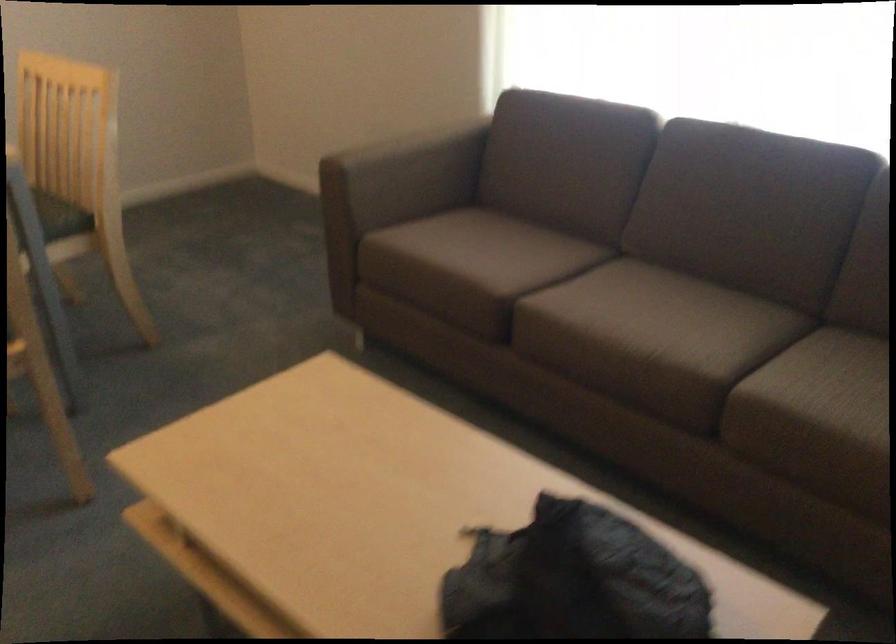
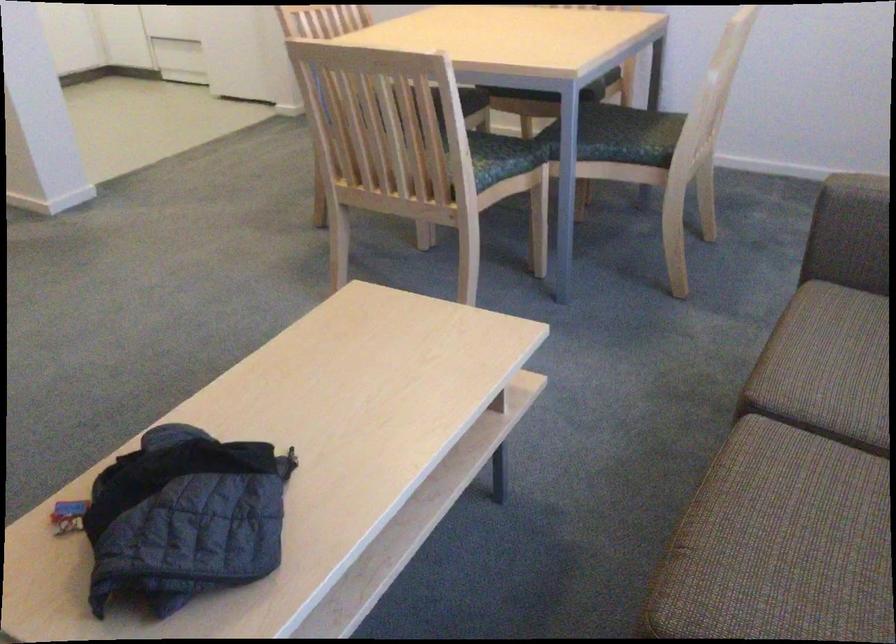
In the second image, find the point that corresponds to pixel 597 312 in the first image.

(794, 489)